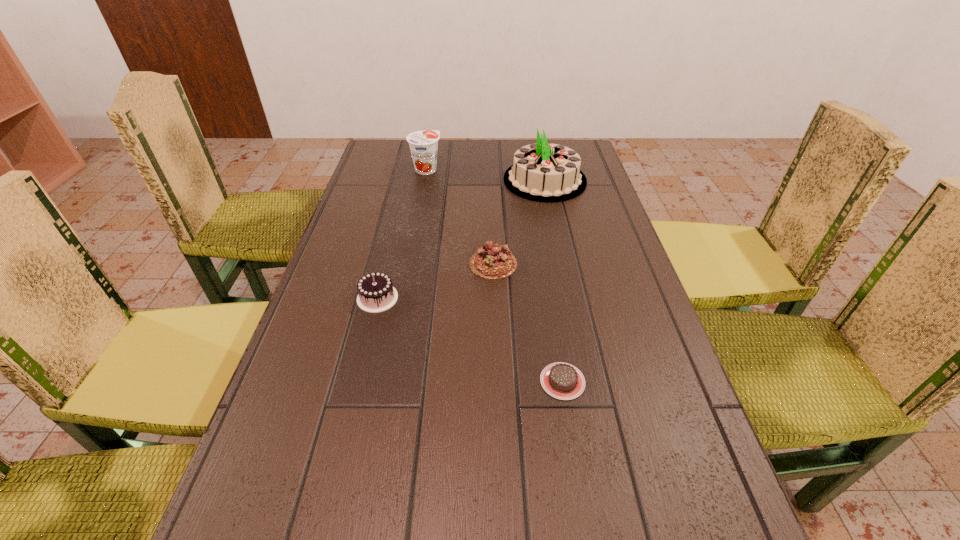
Find the location of `free space located 0.050m on the front of the third shortest object`. free space located 0.050m on the front of the third shortest object is located at coordinates (370, 330).

This screenshot has width=960, height=540. I want to click on vacant space located on the right of the second shortest object, so click(x=594, y=264).

Locate an element on the screen. This screenshot has height=540, width=960. blank area located 0.350m on the left of the nearest chocolate cake is located at coordinates (355, 381).

In order to click on birthday cake positioned at the far edge in this screenshot , I will do `click(543, 172)`.

The width and height of the screenshot is (960, 540). I want to click on yogurt positioned at the far edge, so click(423, 144).

You are a GUI agent. You are given a task and a screenshot of the screen. Output one action in this format:
    pyautogui.click(x=<x>, y=<y>)
    Task: Click on the yogurt that is at the left edge
    The image size is (960, 540).
    Given the screenshot: What is the action you would take?
    pyautogui.click(x=423, y=144)

Where is `chocolate cake that is at the left edge`? chocolate cake that is at the left edge is located at coordinates (376, 293).

Locate an element on the screen. The image size is (960, 540). object at the right edge is located at coordinates (543, 172).

The image size is (960, 540). In order to click on object present at the far left corner in this screenshot , I will do `click(423, 144)`.

Identify the location of object present at the far right corner. The image size is (960, 540). tap(543, 172).